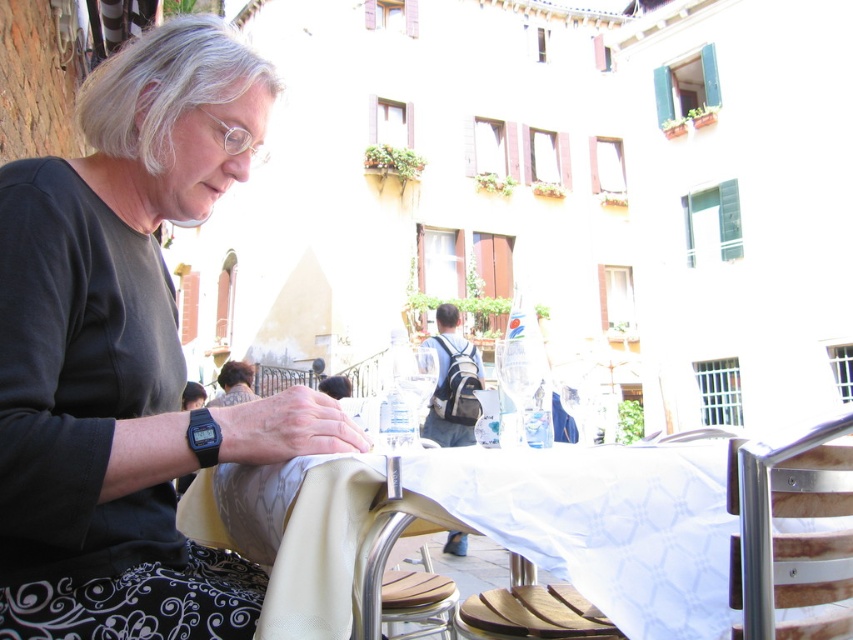
Can you confirm if white fabric table at center is taller than dark brown hair at center?

In fact, white fabric table at center may be shorter than dark brown hair at center.

From the picture: Who is higher up, white fabric table at center or dark brown hair at center?

dark brown hair at center

At what (x,y) coordinates should I click in order to perform the action: click on white fabric table at center. Please return your answer as a coordinate pair (x, y). Image resolution: width=853 pixels, height=640 pixels. Looking at the image, I should click on (602, 524).

Find the location of a particular element. white fabric table at center is located at coordinates (602, 524).

Can you confirm if satin silver chair at lower center is positioned below dark brown hair at center?

Indeed, satin silver chair at lower center is positioned under dark brown hair at center.

Does satin silver chair at lower center come in front of dark brown hair at center?

That is True.

Find the location of a particular element. satin silver chair at lower center is located at coordinates (387, 557).

Does matte black shirt at center appear on the left side of white fabric table at center?

Indeed, matte black shirt at center is positioned on the left side of white fabric table at center.

Does matte black shirt at center lie in front of white fabric table at center?

That is False.

Does point (120, 84) come behind point (631, 449)?

Yes, point (120, 84) is behind point (631, 449).

The width and height of the screenshot is (853, 640). Identify the location of matte black shirt at center. (128, 355).